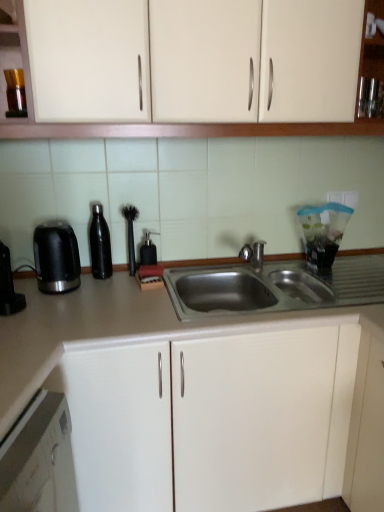
Where is `free space to the left of clear plastic blender at right, placed as the 1th appliance when sorted from right to left`? The width and height of the screenshot is (384, 512). free space to the left of clear plastic blender at right, placed as the 1th appliance when sorted from right to left is located at coordinates (281, 269).